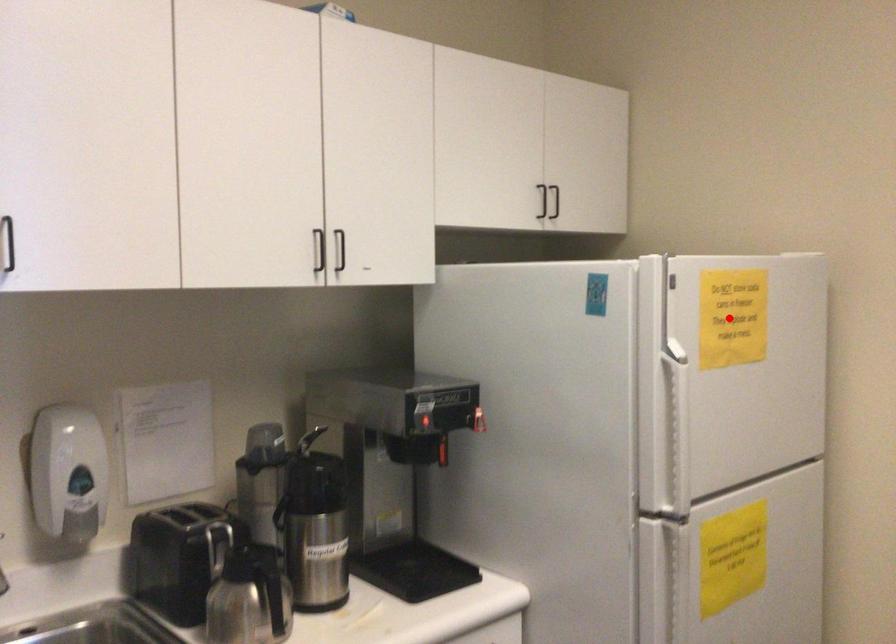
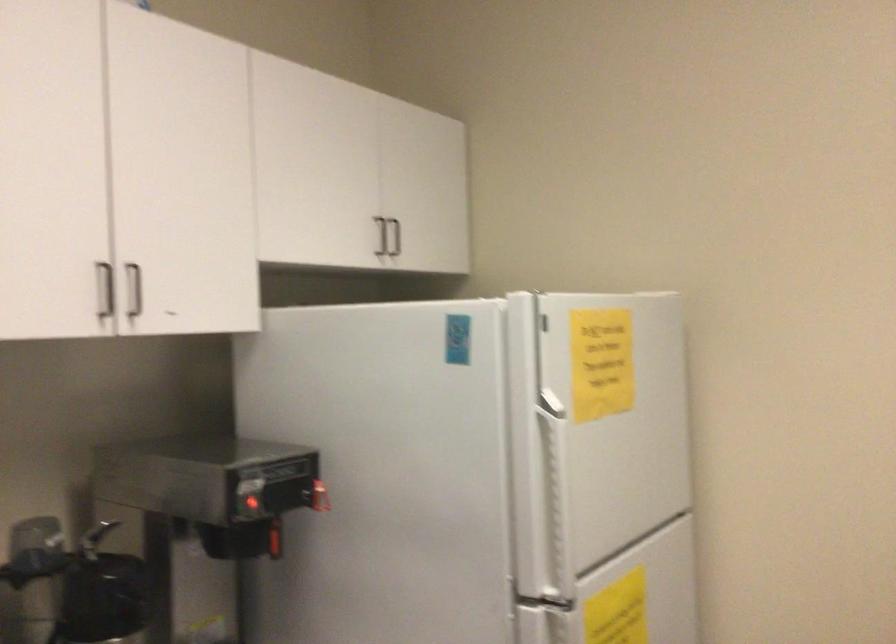
In the second image, find the point that corresponds to the highlighted location in the first image.

(600, 363)